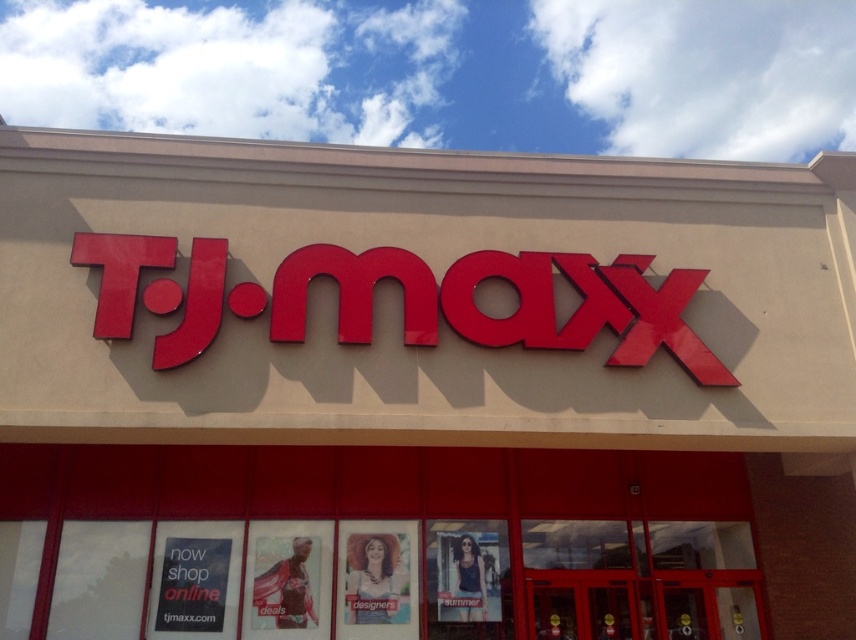
Which is below, glossy red sign at center or black paper sign at lower left?

black paper sign at lower left

Is glossy red sign at center wider than black paper sign at lower left?

Incorrect, glossy red sign at center's width does not surpass black paper sign at lower left's.

At what (x,y) coordinates should I click in order to perform the action: click on glossy red sign at center. Please return your answer as a coordinate pair (x, y). Image resolution: width=856 pixels, height=640 pixels. Looking at the image, I should click on (509, 314).